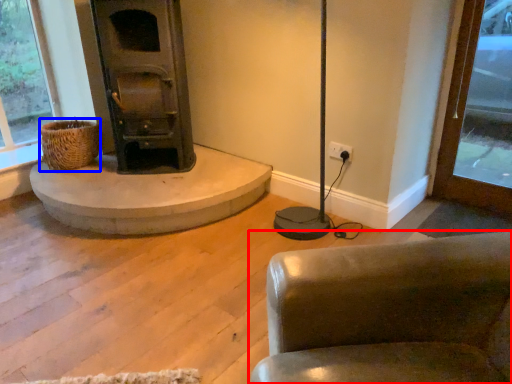
Question: Which of the following is the farthest to the observer, chair (highlighted by a red box) or basket (highlighted by a blue box)?

Choices:
 (A) chair
 (B) basket

Answer: (B)